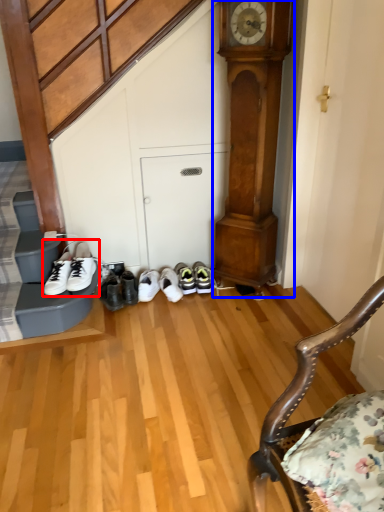
Question: Which point is further to the camera, footwear (highlighted by a red box) or clock (highlighted by a blue box)?

Choices:
 (A) footwear
 (B) clock

Answer: (A)